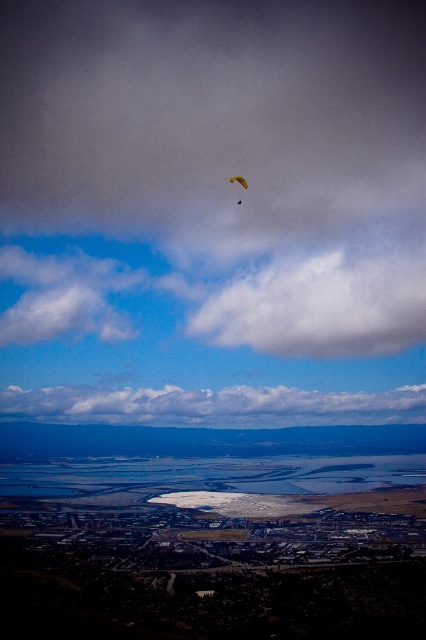
Question: Can you confirm if white fluffy cloud at upper center is positioned above white fluffy cloud at center?

Choices:
 (A) yes
 (B) no

Answer: (A)

Question: Estimate the real-world distances between objects in this image. Which object is closer to the white fluffy cloud at upper center?

Choices:
 (A) white fluffy cloud at center
 (B) yellow fabric parasail at upper center

Answer: (A)

Question: Is white fluffy cloud at upper center bigger than white fluffy cloud at center?

Choices:
 (A) no
 (B) yes

Answer: (B)

Question: Which object is positioned farthest from the white fluffy cloud at center?

Choices:
 (A) white fluffy cloud at upper center
 (B) yellow fabric parasail at upper center

Answer: (B)

Question: Where is white fluffy cloud at upper center located in relation to white fluffy cloud at center in the image?

Choices:
 (A) above
 (B) below

Answer: (A)

Question: Which object is positioned closest to the white fluffy cloud at center?

Choices:
 (A) yellow fabric parasail at upper center
 (B) white fluffy cloud at upper center

Answer: (B)